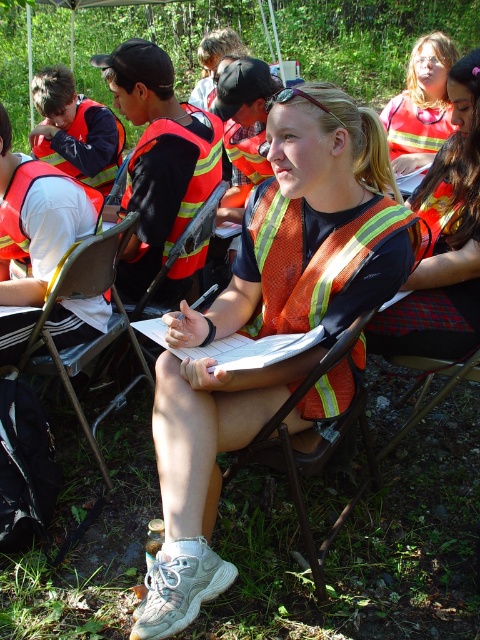
Question: Estimate the real-world distances between objects in this image. Which object is closer to the reflective orange life jacket at center?

Choices:
 (A) orange reflective vest at left
 (B) orange reflective vest at center
 (C) metallic folding chair at center
 (D) metallic silver chair at center

Answer: (D)

Question: Is matte orange safety vest at upper right thinner than reflective orange life jacket at center?

Choices:
 (A) no
 (B) yes

Answer: (B)

Question: Which is farther from the orange reflective vest at left?

Choices:
 (A) orange reflective vest at center
 (B) reflective orange vest at center
 (C) metallic silver chair at center

Answer: (A)

Question: Is reflective orange vest at center smaller than metallic folding chair at center?

Choices:
 (A) no
 (B) yes

Answer: (A)

Question: Which of the following is the closest to the observer?

Choices:
 (A) (142, 625)
 (B) (436, 163)

Answer: (A)

Question: Does matte orange safety vest at upper right appear on the right side of orange reflective vest at left?

Choices:
 (A) yes
 (B) no

Answer: (A)